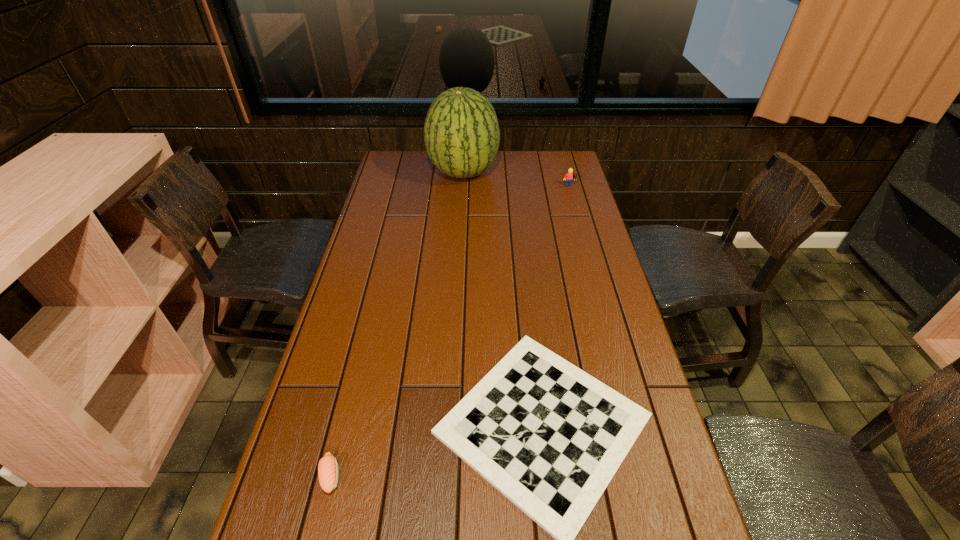
In order to click on object that can be found as the third closest to the second tallest object in this screenshot , I will do `click(328, 472)`.